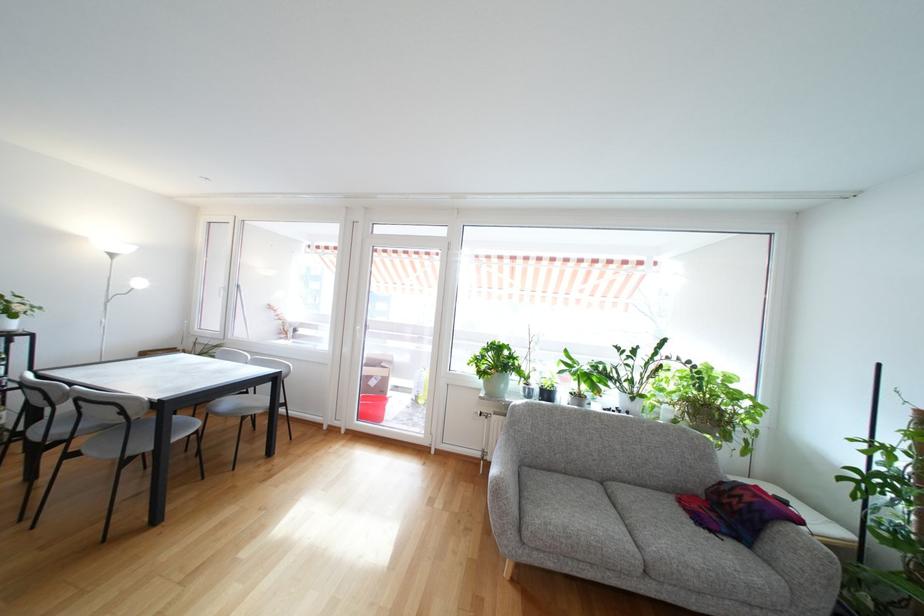
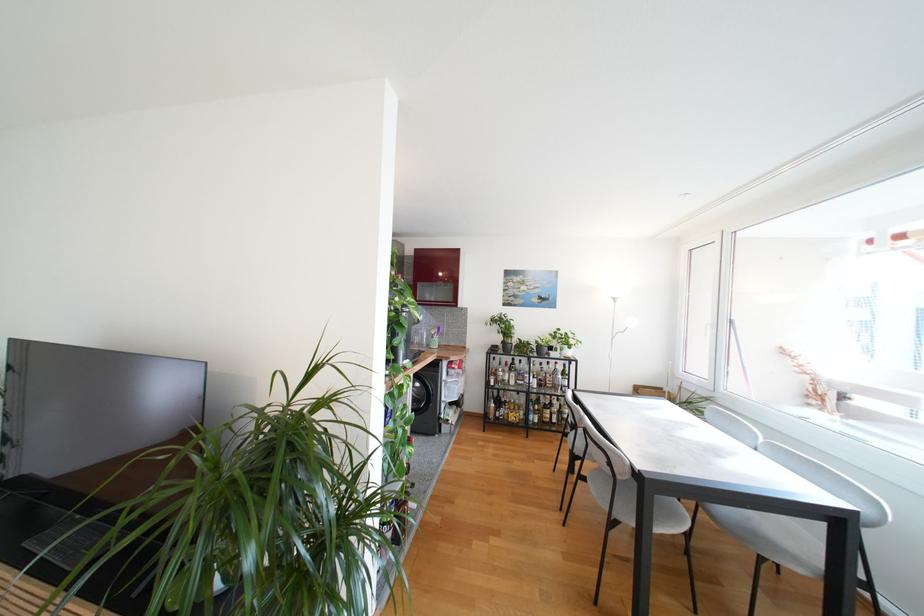
In the second image, find the point that corresponds to pixel 79 456 in the first image.

(589, 480)